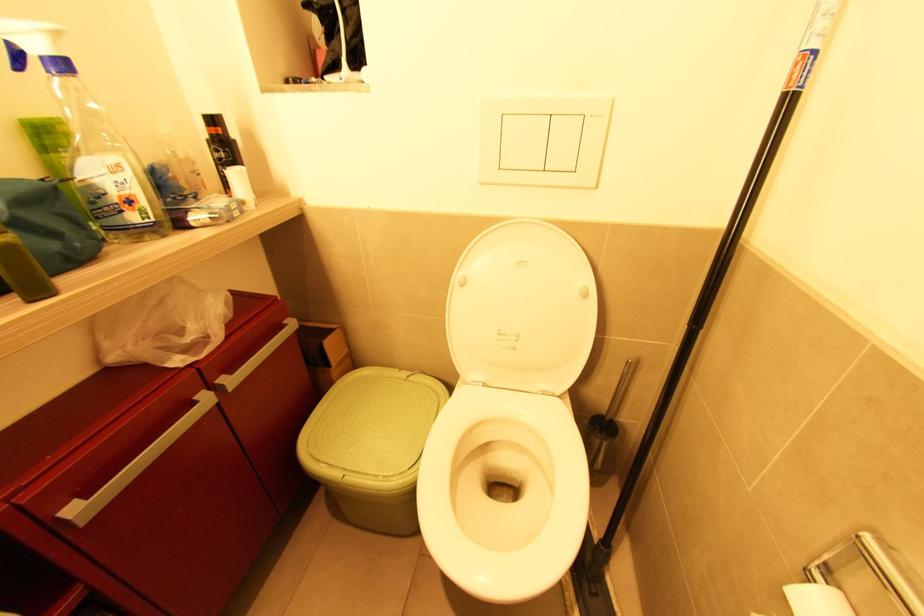
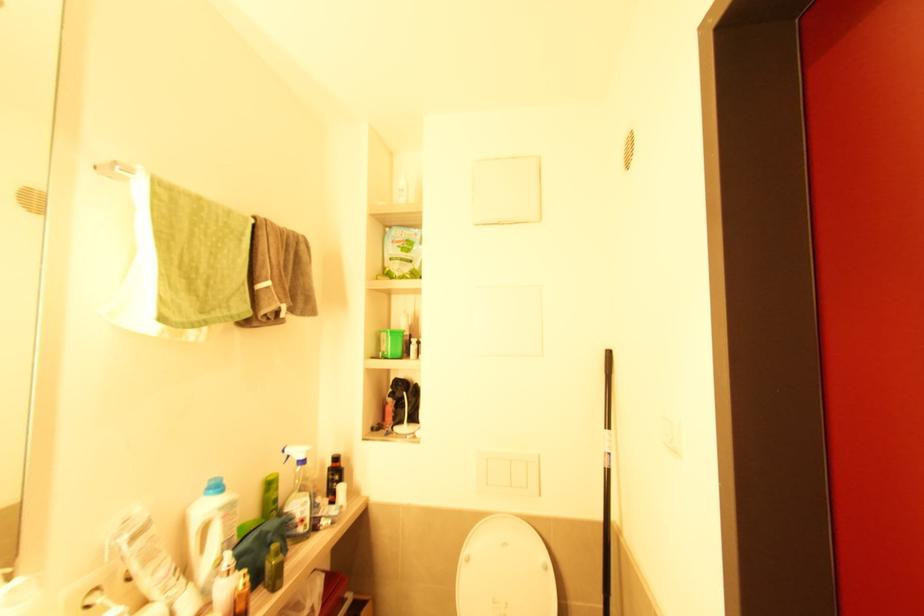
Where in the second image is the point corresponding to point (465, 285) from the first image?

(469, 561)